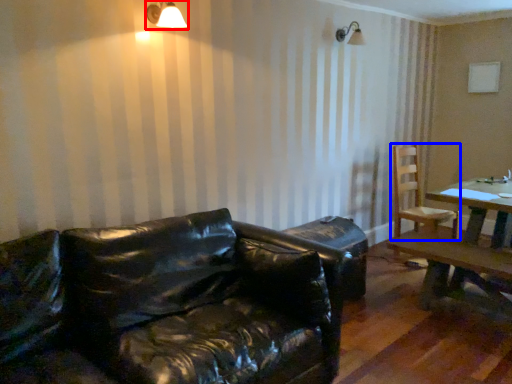
Question: Which point is closer to the camera, light fixture (highlighted by a red box) or chair (highlighted by a blue box)?

Choices:
 (A) light fixture
 (B) chair

Answer: (A)